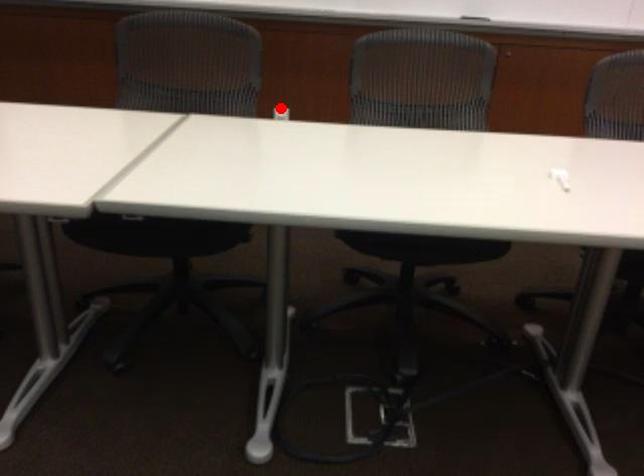
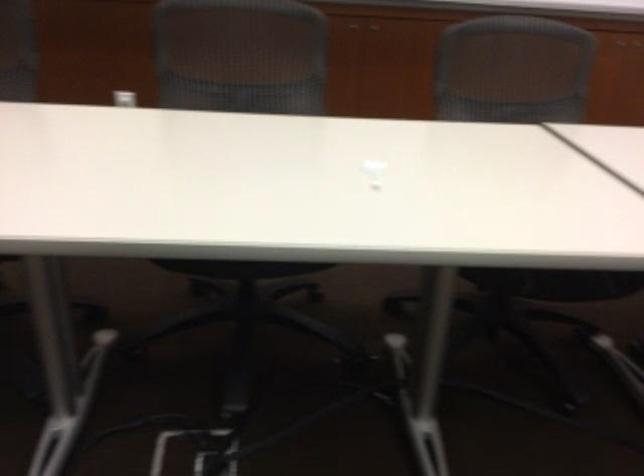
Question: I am providing you with two images of the same scene from different viewpoints. Given a red point in image1, look at the same physical point in image2. Is it:

Choices:
 (A) Closer to the viewpoint
 (B) Farther from the viewpoint

Answer: (A)